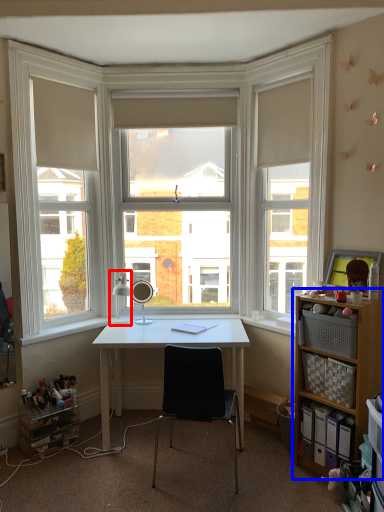
Question: Among these objects, which one is nearest to the camera, table lamp (highlighted by a red box) or shelf (highlighted by a blue box)?

Choices:
 (A) table lamp
 (B) shelf

Answer: (B)